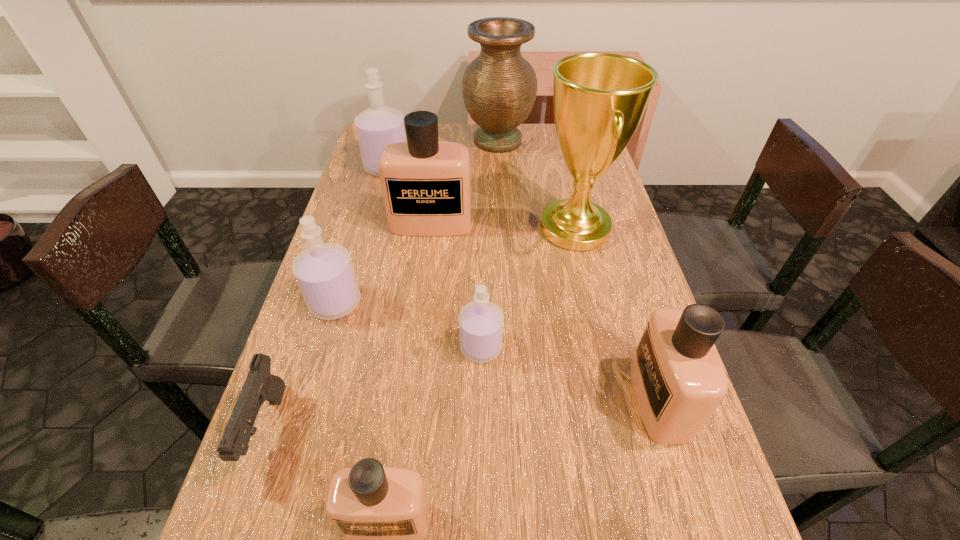
Locate an element on the screen. The height and width of the screenshot is (540, 960). award is located at coordinates (599, 99).

I want to click on vase, so click(499, 87).

Image resolution: width=960 pixels, height=540 pixels. Identify the location of the fifth nearest perfume. (426, 184).

The height and width of the screenshot is (540, 960). I want to click on the biggest beige perfume, so click(x=426, y=184).

You are a GUI agent. You are given a task and a screenshot of the screen. Output one action in this format:
    pyautogui.click(x=<x>, y=<y>)
    Task: Click on the farthest purple perfume
    The width and height of the screenshot is (960, 540).
    Given the screenshot: What is the action you would take?
    pyautogui.click(x=379, y=125)

Locate an element on the screen. This screenshot has height=540, width=960. the biggest purple perfume is located at coordinates (379, 125).

Identify the location of the fourth nearest perfume. This screenshot has width=960, height=540. (324, 272).

Locate an element on the screen. The height and width of the screenshot is (540, 960). the second smallest purple perfume is located at coordinates (324, 272).

Where is `the second nearest beige perfume`? The width and height of the screenshot is (960, 540). the second nearest beige perfume is located at coordinates (678, 378).

This screenshot has height=540, width=960. In order to click on the rightmost beige perfume in this screenshot , I will do `click(678, 378)`.